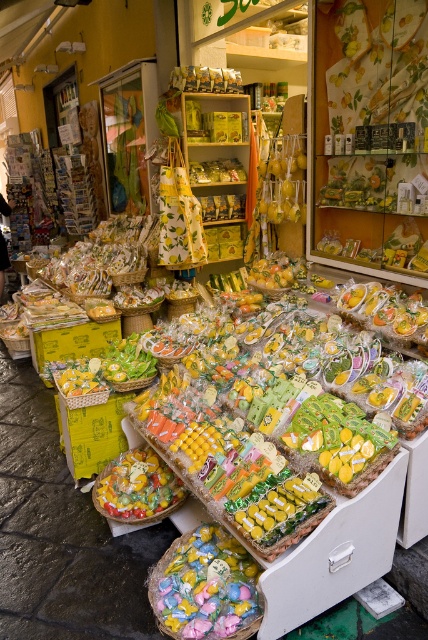
Who is lower down, pastel candy at center or translucent plastic candy at center?

pastel candy at center

Is pastel candy at center taller than translucent plastic candy at center?

In fact, pastel candy at center may be shorter than translucent plastic candy at center.

Who is more forward, (178, 628) or (98, 499)?

Positioned in front is point (178, 628).

Find the location of a particular element. The height and width of the screenshot is (640, 428). pastel candy at center is located at coordinates (205, 588).